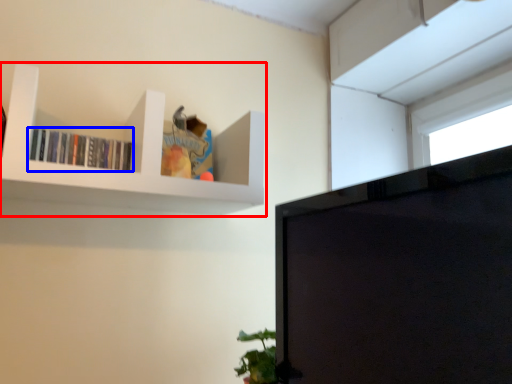
Question: Which point is further to the camera, shelf (highlighted by a red box) or book (highlighted by a blue box)?

Choices:
 (A) shelf
 (B) book

Answer: (B)